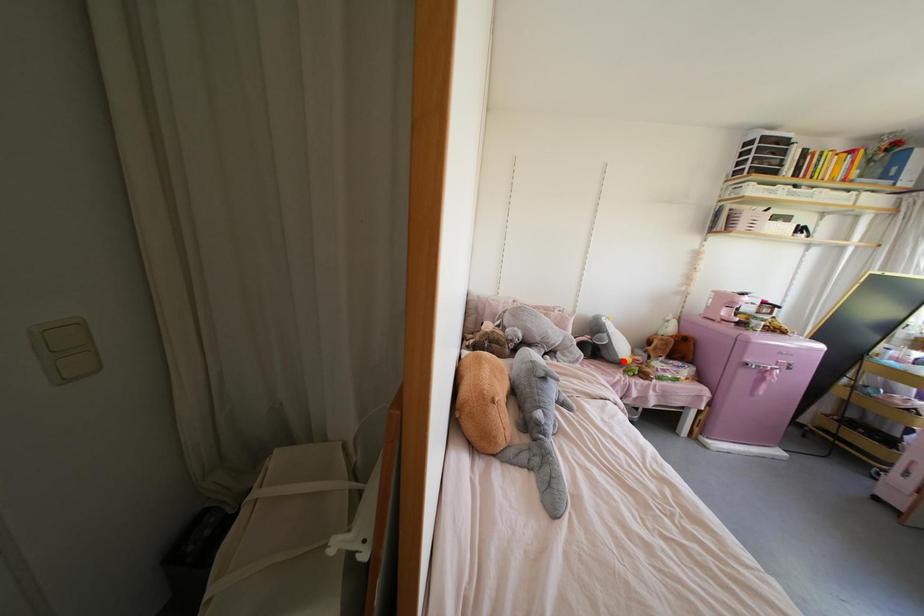
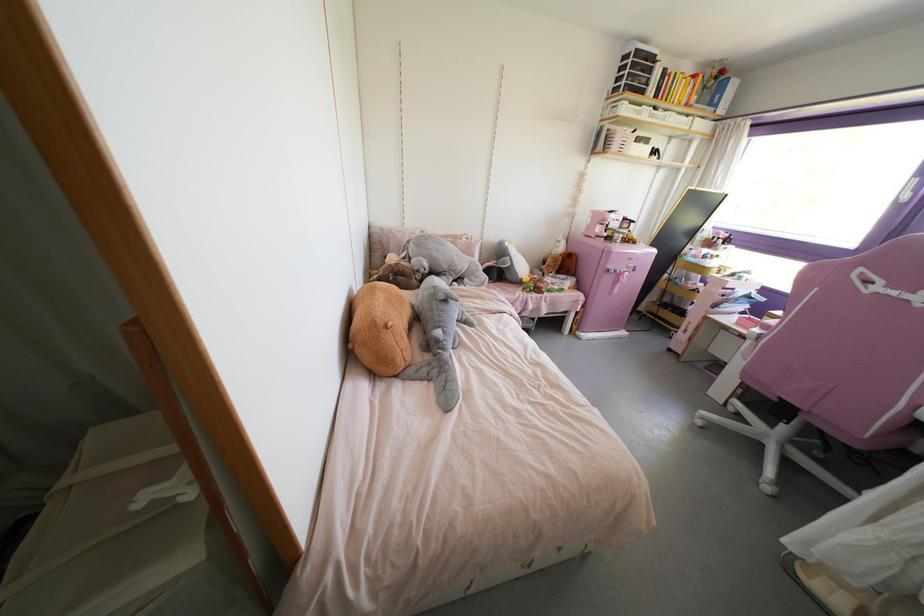
The point at the highlighted location is marked in the first image. Where is the corresponding point in the second image?

(523, 280)